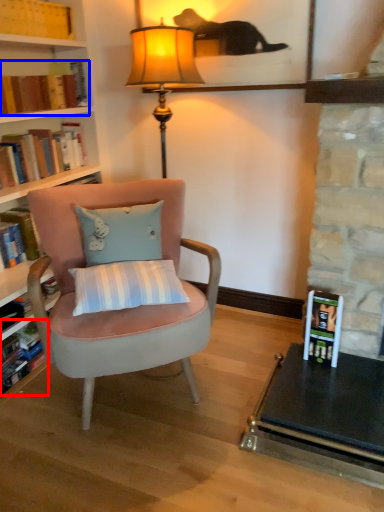
Question: Which point is further to the camera, book (highlighted by a red box) or book (highlighted by a blue box)?

Choices:
 (A) book
 (B) book

Answer: (B)